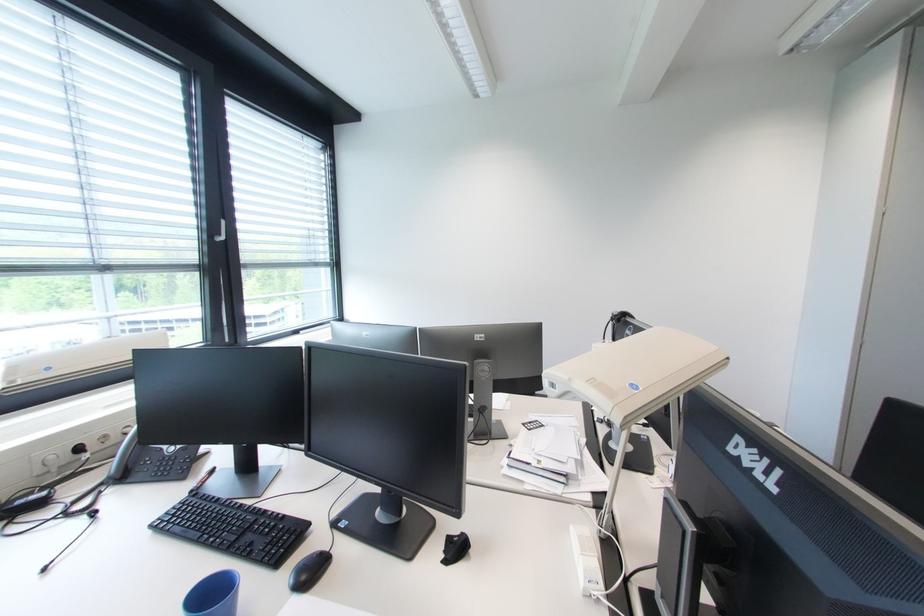
What do you see at coordinates (222, 231) in the screenshot? This screenshot has height=616, width=924. I see `a white window handle` at bounding box center [222, 231].